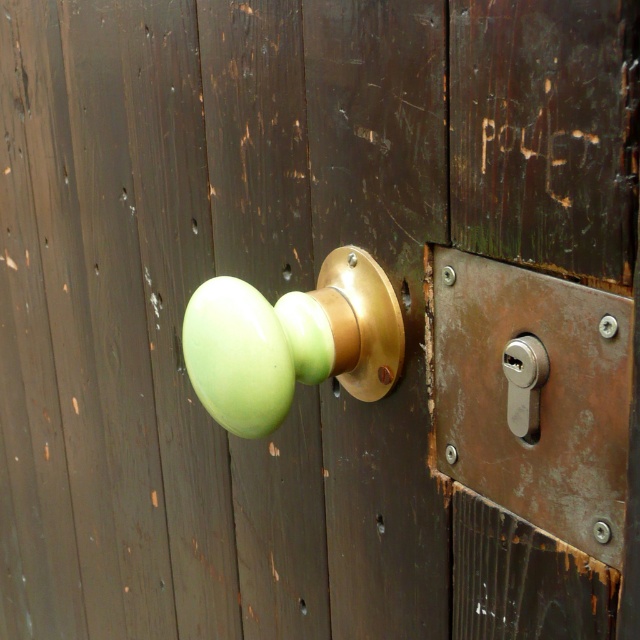
Locate an element on the screen. This screenshot has height=640, width=640. green matte door handle at center is located at coordinates (291, 340).

Does green matte door handle at center appear under satin silver lock at right?

No.

Does point (218, 355) come farther from viewer compared to point (532, 403)?

Yes.

Find the location of a particular element. green matte door handle at center is located at coordinates (291, 340).